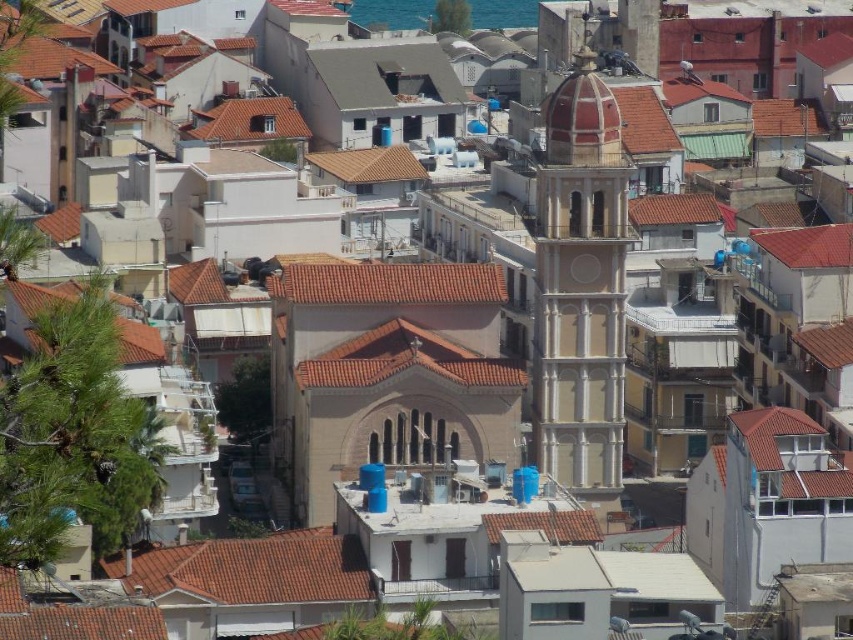
Which of these two, brown textured church at center or matte pink tower at center, stands taller?

matte pink tower at center

Can you confirm if brown textured church at center is shorter than matte pink tower at center?

Correct, brown textured church at center is not as tall as matte pink tower at center.

Image resolution: width=853 pixels, height=640 pixels. What do you see at coordinates (386, 372) in the screenshot?
I see `brown textured church at center` at bounding box center [386, 372].

Image resolution: width=853 pixels, height=640 pixels. Identify the location of brown textured church at center. (386, 372).